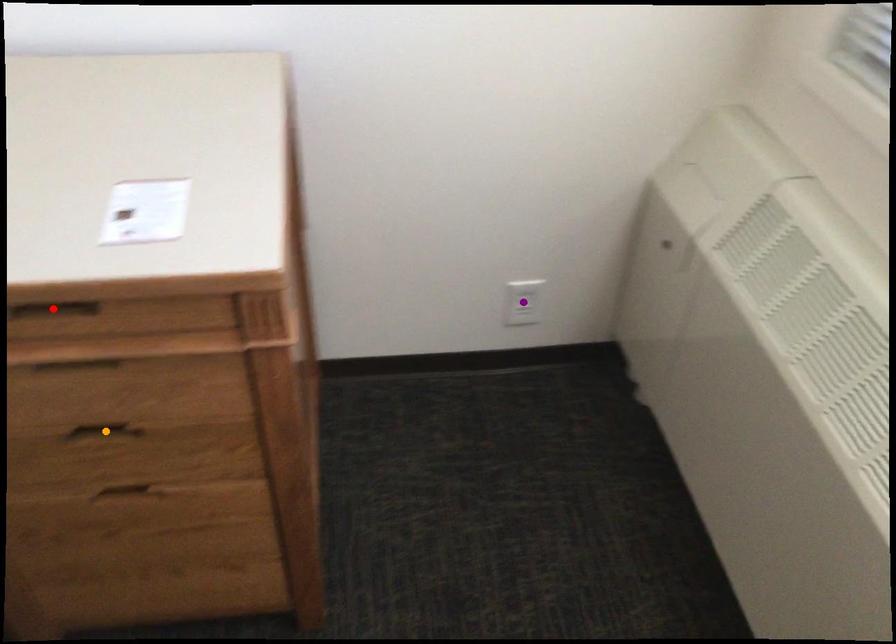
Order these from nearest to farthest:
red point | purple point | orange point

red point
orange point
purple point